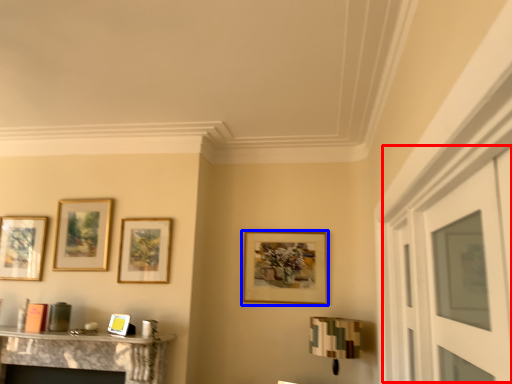
Question: Which point is further to the camera, glass door (highlighted by a red box) or picture frame (highlighted by a blue box)?

Choices:
 (A) glass door
 (B) picture frame

Answer: (B)